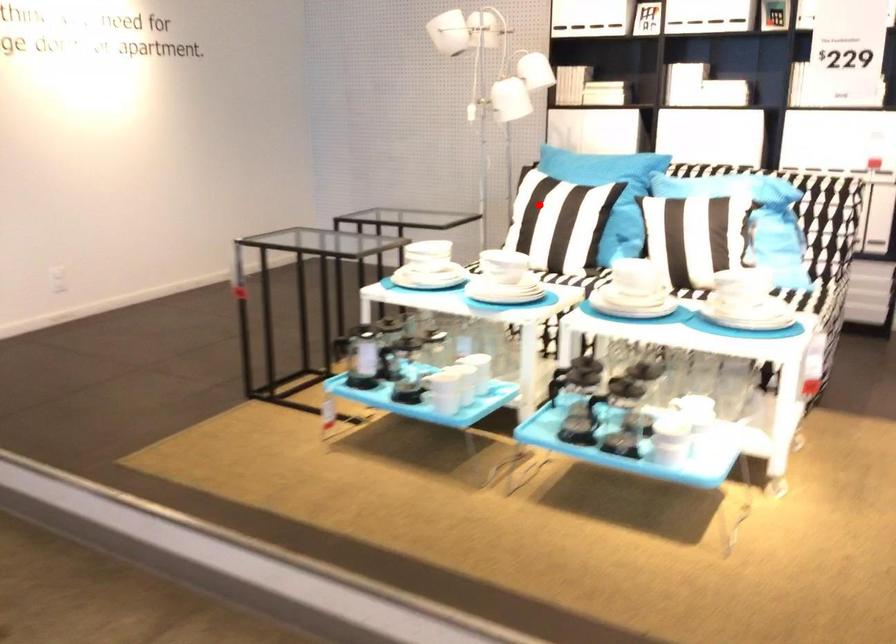
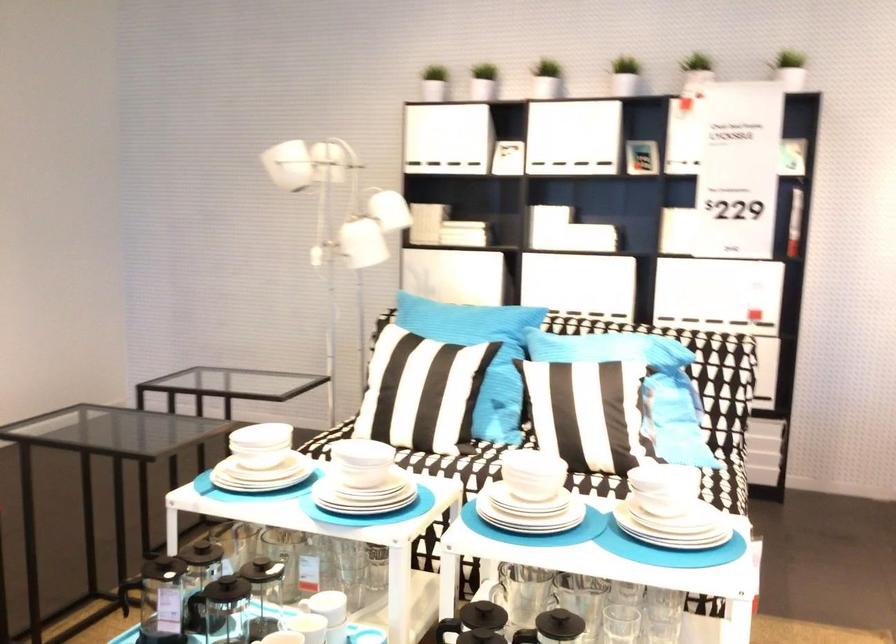
The point at the highlighted location is marked in the first image. Where is the corresponding point in the second image?

(398, 377)